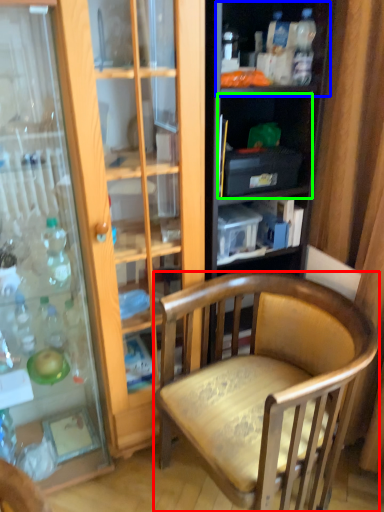
Question: Which is farther away from chair (highlighted by a red box)? shelf (highlighted by a blue box) or shelf (highlighted by a green box)?

Choices:
 (A) shelf
 (B) shelf

Answer: (A)